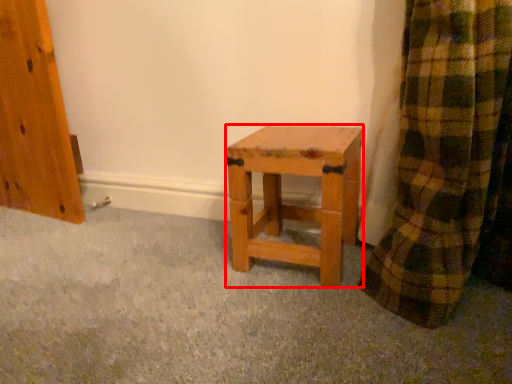
Question: From the image's perspective, what is the correct spatial relationship of stool (annotated by the red box) in relation to concrete?

Choices:
 (A) below
 (B) above

Answer: (B)